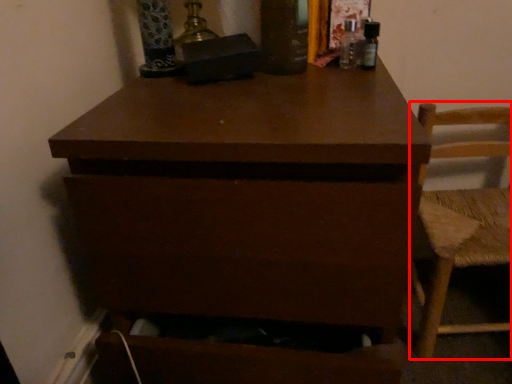
Question: Considering the relative positions of chair (annotated by the red box) and chest of drawers in the image provided, where is chair (annotated by the red box) located with respect to the staircase?

Choices:
 (A) left
 (B) right

Answer: (B)